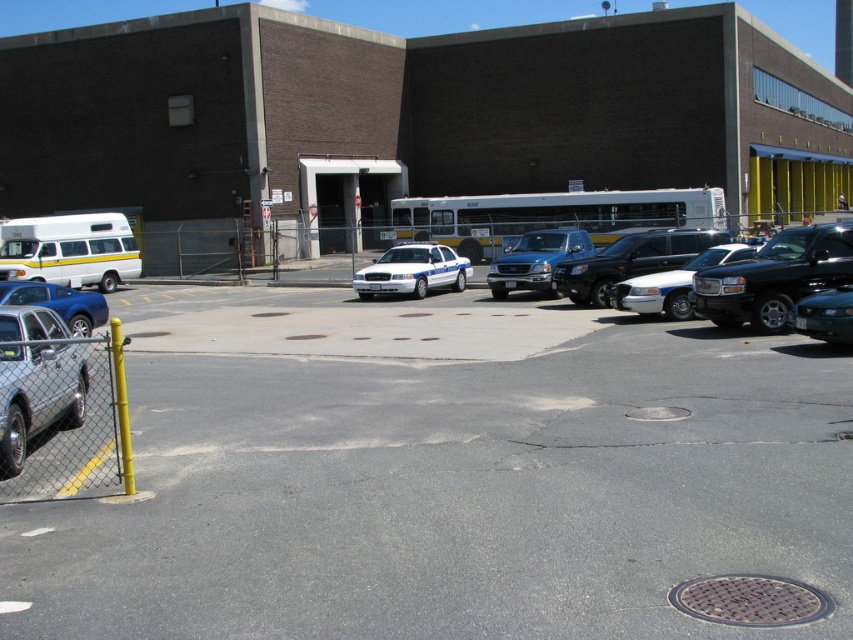
Question: Which is farther from the shiny black suv at center?

Choices:
 (A) white matte van at left
 (B) black glossy sedan at right
 (C) white glossy sedan at center

Answer: (A)

Question: Which point is closer to the camera?

Choices:
 (A) (431, 285)
 (B) (561, 257)

Answer: (B)

Question: Can you confirm if white glossy police car at center is positioned to the left of white glossy sedan at center?

Choices:
 (A) no
 (B) yes

Answer: (B)

Question: Is white glossy police car at center above shiny blue sedan at left?

Choices:
 (A) yes
 (B) no

Answer: (A)

Question: Does satin black truck at center appear under white glossy sedan at center?

Choices:
 (A) yes
 (B) no

Answer: (B)

Question: Among these points, which one is nearest to the camera?

Choices:
 (A) (97, 300)
 (B) (634, 244)
 (C) (834, 291)
 (D) (758, 269)

Answer: (C)